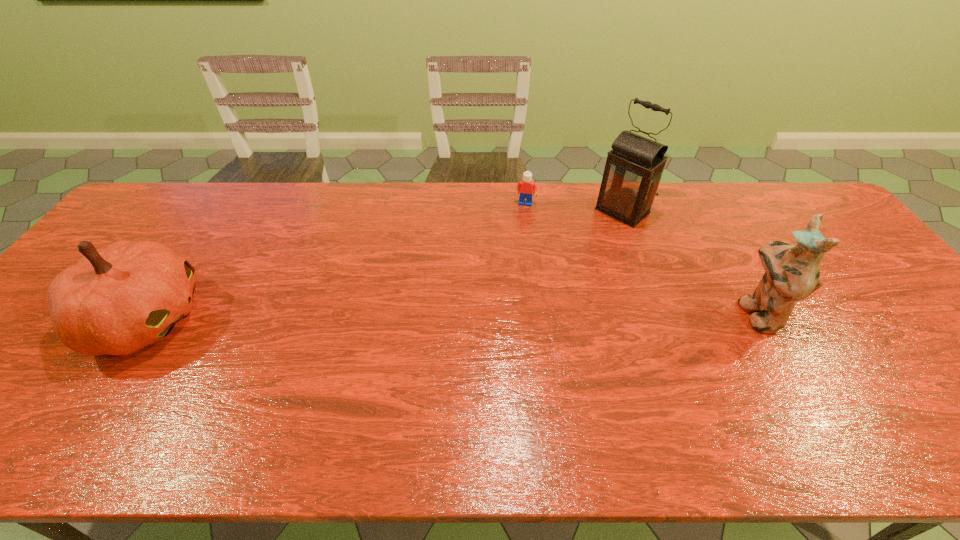
This screenshot has width=960, height=540. I want to click on free point located 0.200m on the front-facing side of the figurine, so click(x=660, y=313).

Locate an element on the screen. This screenshot has width=960, height=540. vacant space located 0.400m on the face of the third object from right to left is located at coordinates point(506,296).

You are a GUI agent. You are given a task and a screenshot of the screen. Output one action in this format:
    pyautogui.click(x=<x>, y=<y>)
    Task: Click on the vacant space positioned 0.240m on the face of the third object from right to left
    
    Given the screenshot: What is the action you would take?
    pyautogui.click(x=515, y=256)

Locate an element on the screen. This screenshot has height=540, width=960. free space located 0.390m on the face of the third object from right to left is located at coordinates (507, 294).

Identify the location of free space located on the front-facing side of the third object from left to right. The image size is (960, 540). (551, 271).

Locate an element on the screen. vacant region located 0.370m on the front-facing side of the third object from left to right is located at coordinates [534, 286].

Image resolution: width=960 pixels, height=540 pixels. What are the coordinates of `blank space located 0.060m on the front-facing side of the third object from left to right` in the screenshot? It's located at (597, 233).

At what (x,y) coordinates should I click in order to perform the action: click on Lego present at the far edge. Please return your answer as a coordinate pair (x, y). The width and height of the screenshot is (960, 540). Looking at the image, I should click on (525, 187).

You are a GUI agent. You are given a task and a screenshot of the screen. Output one action in this format:
    pyautogui.click(x=<x>, y=<y>)
    Task: Click on the lantern present at the far edge
    The height and width of the screenshot is (540, 960).
    Given the screenshot: What is the action you would take?
    pyautogui.click(x=633, y=170)

Locate an element on the screen. This screenshot has height=540, width=960. object situated at the left edge is located at coordinates pyautogui.click(x=116, y=300).